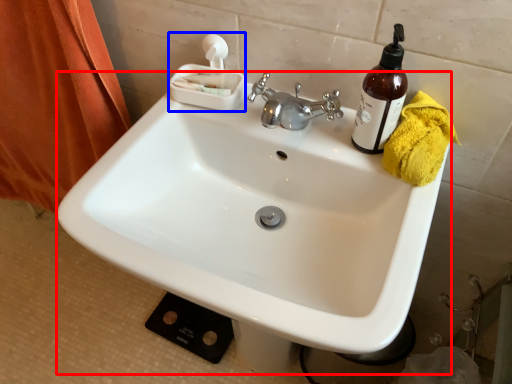
Question: Which object appears farthest to the camera in this image, sink (highlighted by a red box) or tissue (highlighted by a blue box)?

Choices:
 (A) sink
 (B) tissue

Answer: (B)